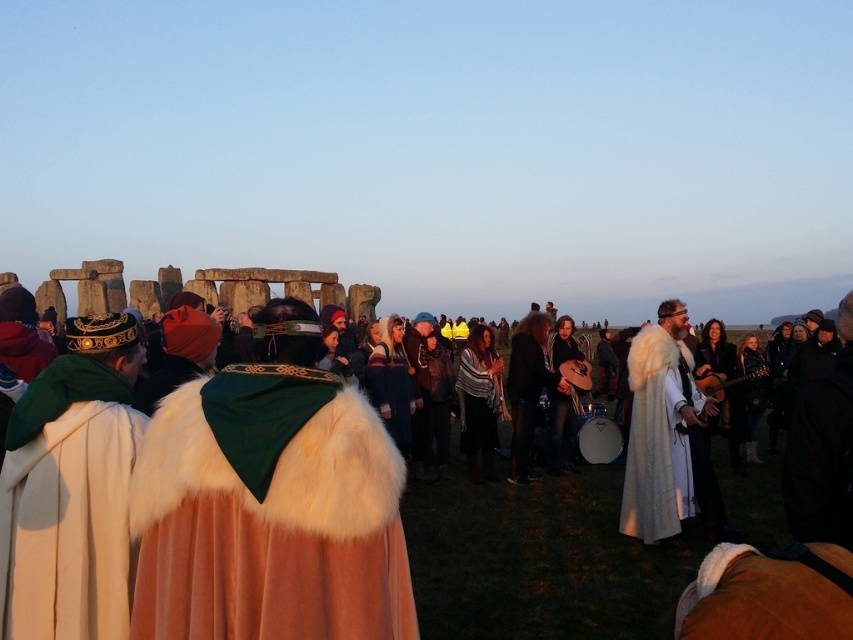
You are an archaeologist examining the Stonehenge scene. You notice two items of clothing made from white fur. The first is the white fur cape at center, and the second is the white fur coat at right. Which of these items is covering part of the other?

The white fur cape at center is positioned over the white fur coat at right, so the cape is covering part of the coat.

You are standing at the origin point in the image. Where is the white fur cloak at center located in terms of 2D coordinates?

The white fur cloak at center is located at the 2D coordinates of point (538, 561).